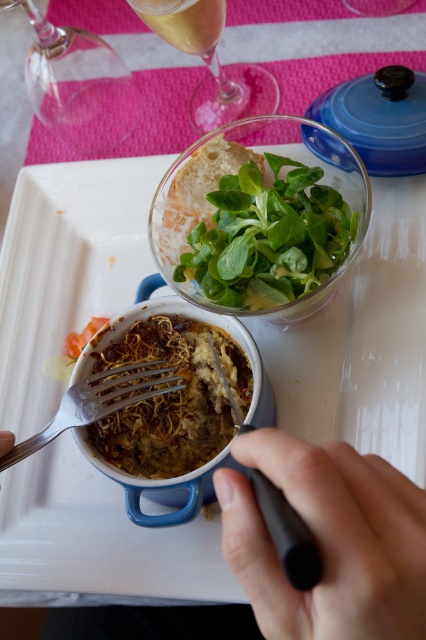
Can you confirm if transparent glass at upper left is positioned to the left of transparent glass bowl at upper center?

Correct, you'll find transparent glass at upper left to the left of transparent glass bowl at upper center.

Does transparent glass at upper left lie behind transparent glass bowl at upper center?

That is True.

Is point (34, 86) positioned after point (253, 116)?

Yes, it is behind point (253, 116).

This screenshot has height=640, width=426. I want to click on transparent glass at upper left, so click(77, 84).

Is point (276, 595) behind point (307, 310)?

No, it is in front of (307, 310).

Does point (385, 477) lie behind point (169, 227)?

No, it is in front of (169, 227).

Identify the location of black rubber pen at lower center. (328, 540).

Does blue ceramic bowl at center have a smaller size compared to black plastic fork at lower center?

Incorrect, blue ceramic bowl at center is not smaller in size than black plastic fork at lower center.

This screenshot has width=426, height=640. What do you see at coordinates (362, 342) in the screenshot?
I see `blue ceramic bowl at center` at bounding box center [362, 342].

Is point (58, 276) positioned before point (290, 577)?

No.

Where is `blue ceramic bowl at center`? blue ceramic bowl at center is located at coordinates (362, 342).